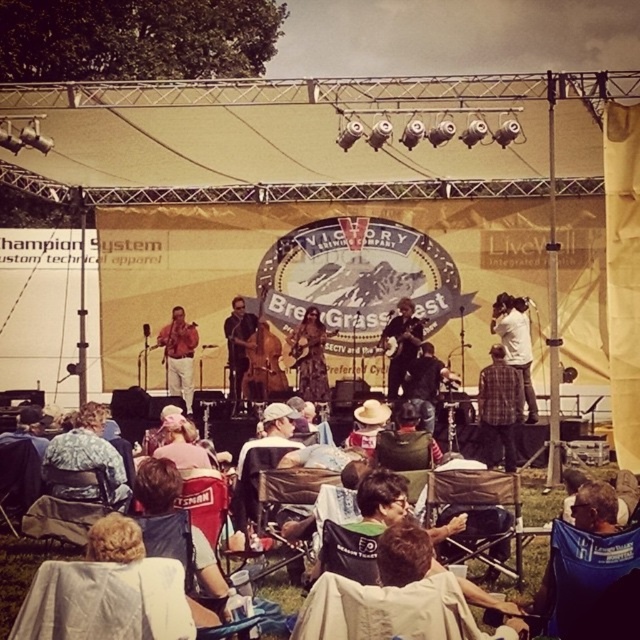
Is white shirt at upper center taller than matte brown guitar at center?

Yes, white shirt at upper center is taller than matte brown guitar at center.

Is point (506, 301) farther from camera compared to point (256, 328)?

No.

This screenshot has height=640, width=640. I want to click on white shirt at upper center, so click(515, 342).

Is point (506, 376) positioned in front of point (228, 314)?

Yes, it is in front of point (228, 314).

Which is above, plaid shirt at center or matte brown guitar at center?

matte brown guitar at center is higher up.

Does point (484, 390) come farther from viewer compared to point (232, 340)?

No, (484, 390) is closer to viewer.

Where is `plaid shirt at center`? This screenshot has height=640, width=640. plaid shirt at center is located at coordinates (499, 408).

Is fluffy fabric hat at lower left below dark brown leather jacket at center?

Indeed, fluffy fabric hat at lower left is positioned under dark brown leather jacket at center.

Locate an element on the screen. The image size is (640, 640). fluffy fabric hat at lower left is located at coordinates (90, 452).

Find the location of a particular element. This screenshot has height=640, width=640. fluffy fabric hat at lower left is located at coordinates (90, 452).